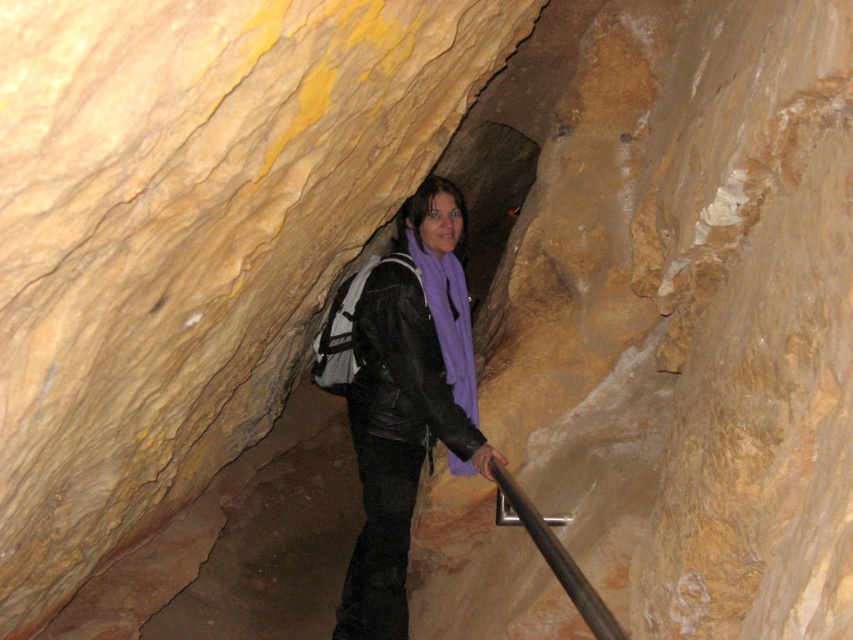
Based on the photo, you are navigating through a narrow cave and need to pass a section where the tunnel narrows. The black leather jacket at center is currently blocking your path. Can you move around it to continue forward?

The black leather jacket at center is located at point (410, 356), so you can move around it by going to the left or right side of the jacket to continue forward.